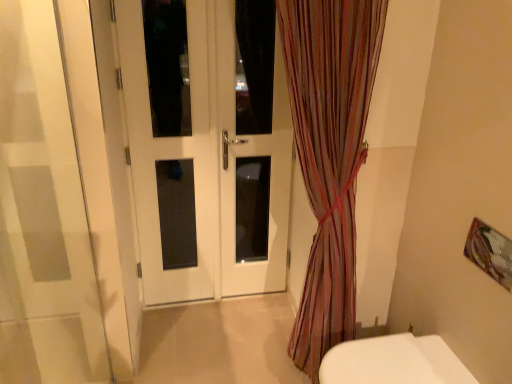
From a real-world perspective, give me the position of a free point above white glossy door at center. Please provide its 2D coordinates.

[(0.405, -0.001)]